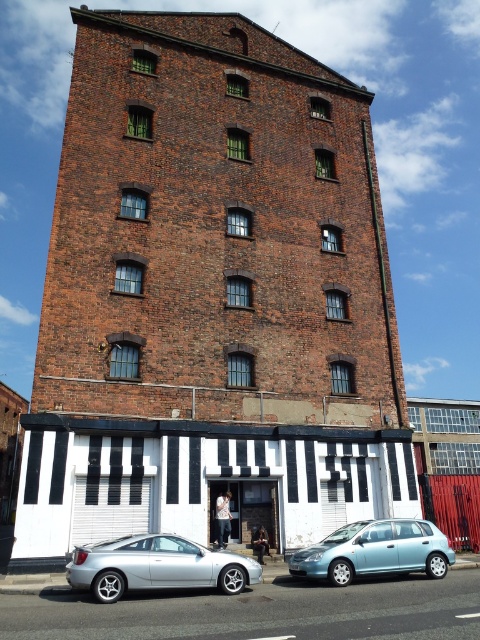
Who is higher up, silver metallic car at lower left or light blue metallic hatchback at lower right?

silver metallic car at lower left is above.

Image resolution: width=480 pixels, height=640 pixels. What are the coordinates of `silver metallic car at lower left` in the screenshot? It's located at point(156,566).

The image size is (480, 640). What do you see at coordinates (156, 566) in the screenshot?
I see `silver metallic car at lower left` at bounding box center [156, 566].

I want to click on silver metallic car at lower left, so click(156, 566).